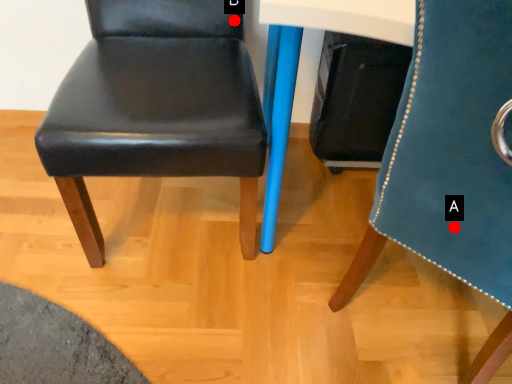
Question: Two points are circled on the image, labeled by A and B beside each circle. Which of the following is the closest to the observer?

Choices:
 (A) A is closer
 (B) B is closer

Answer: (A)